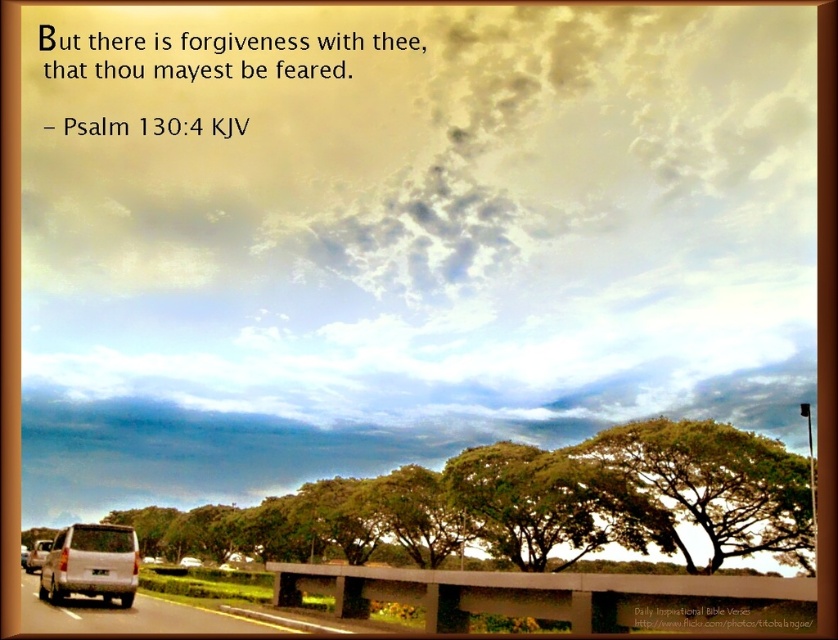
Which is behind, point (709, 541) or point (75, 525)?

The point (709, 541) is behind.

The width and height of the screenshot is (838, 640). What are the coordinates of `green leafy tree at center` in the screenshot? It's located at (704, 490).

Is point (626, 440) farther from viewer compared to point (68, 550)?

Yes, it is.

You are a GUI agent. You are given a task and a screenshot of the screen. Output one action in this format:
    pyautogui.click(x=<x>, y=<y>)
    Task: Click on the green leafy tree at center
    The image size is (838, 640).
    Given the screenshot: What is the action you would take?
    pyautogui.click(x=704, y=490)

Does green leafy tree at center have a greater height compared to metallic silver car at lower left?

In fact, green leafy tree at center may be shorter than metallic silver car at lower left.

Can you confirm if green leafy tree at center is wider than metallic silver car at lower left?

No.

Who is more forward, (663, 435) or (35, 552)?

Point (663, 435) is in front.

Image resolution: width=838 pixels, height=640 pixels. Find the location of `green leafy tree at center`. green leafy tree at center is located at coordinates (704, 490).

Does silver metallic van at lower left appear on the right side of metallic silver car at lower left?

Correct, you'll find silver metallic van at lower left to the right of metallic silver car at lower left.

Does silver metallic van at lower left have a lesser height compared to metallic silver car at lower left?

Yes.

Is point (104, 570) closer to viewer compared to point (35, 548)?

Yes.

At what (x,y) coordinates should I click in order to perform the action: click on silver metallic van at lower left. Please return your answer as a coordinate pair (x, y). The height and width of the screenshot is (640, 838). Looking at the image, I should click on (91, 563).